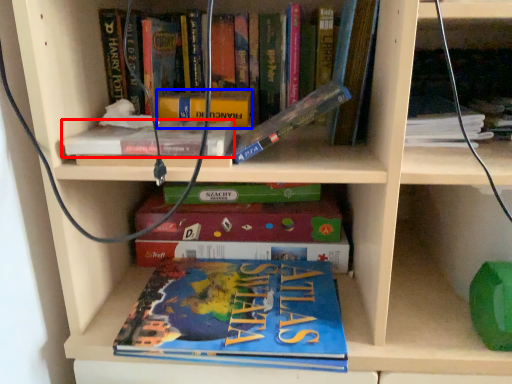
Question: Which point is further to the camera, book (highlighted by a red box) or paperback book (highlighted by a blue box)?

Choices:
 (A) book
 (B) paperback book

Answer: (B)